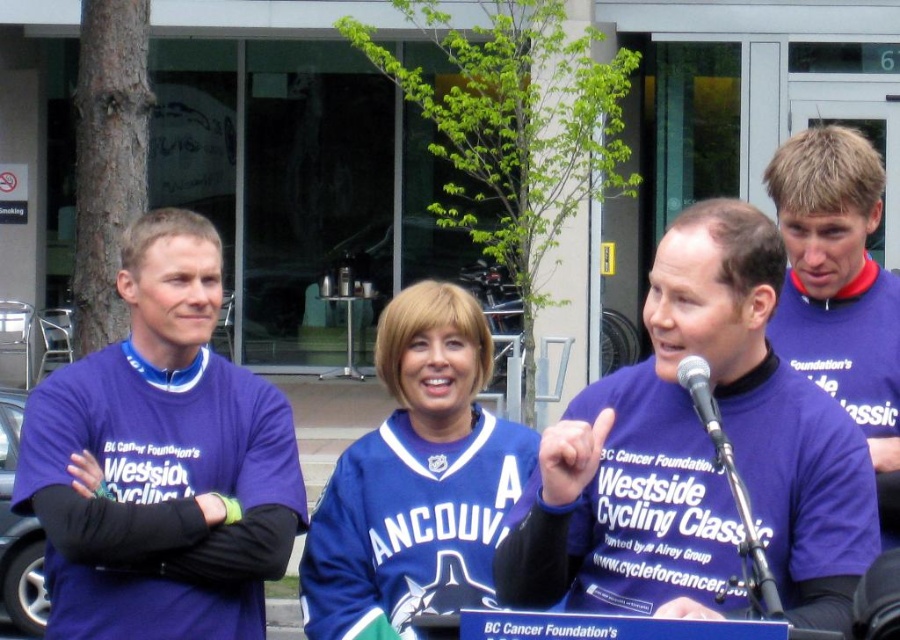
Question: Can you confirm if purple jersey at left is positioned to the right of metallic silver microphone at center?

Choices:
 (A) yes
 (B) no

Answer: (B)

Question: Which point is farther to the camera?

Choices:
 (A) blue jersey at center
 (B) purple jersey at center

Answer: (A)

Question: Based on their relative distances, which object is farther from the purple jersey at left?

Choices:
 (A) purple jersey at center
 (B) metallic silver microphone at center
 (C) blue jersey at center
 (D) purple jersey at right

Answer: (D)

Question: Can you confirm if purple jersey at left is positioned to the right of blue jersey at center?

Choices:
 (A) no
 (B) yes

Answer: (A)

Question: Which object is closer to the camera taking this photo?

Choices:
 (A) blue jersey at center
 (B) purple jersey at right
 (C) purple jersey at left
 (D) purple jersey at center

Answer: (D)

Question: Does blue jersey at center appear over metallic silver microphone at center?

Choices:
 (A) no
 (B) yes

Answer: (A)